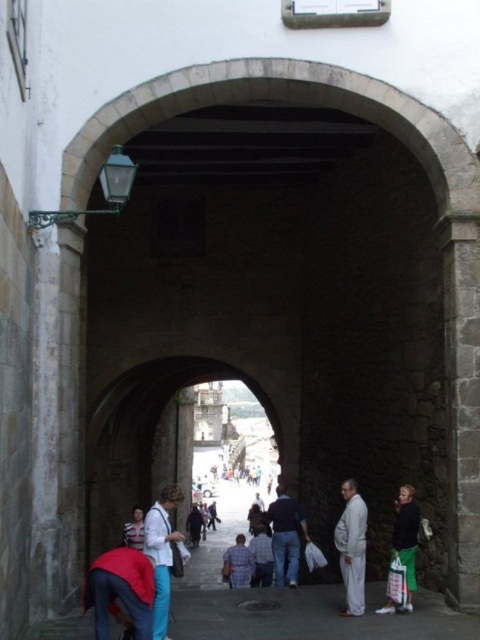
You are standing at the entrance of the historic town square under the stone archway. You notice a point marked at coordinates point (x=351, y=547). Which object in the scene does this point belong to?

The point (x=351, y=547) is on light gray fabric pants at lower right.

You are a tailor who needs to determine which pair of pants to recommend to a customer who prefers wider leg room. Based on the image, which of the two options, the light blue jeans at center or the light gray fabric pants at lower right, would you suggest?

The light blue jeans at center has a larger width than the light gray fabric pants at lower right, so it would be the better recommendation for wider leg room.